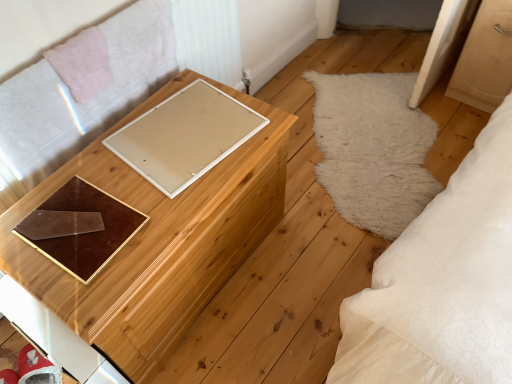
The width and height of the screenshot is (512, 384). What are the coordinates of `free space in front of beige matte board at center` in the screenshot? It's located at (164, 205).